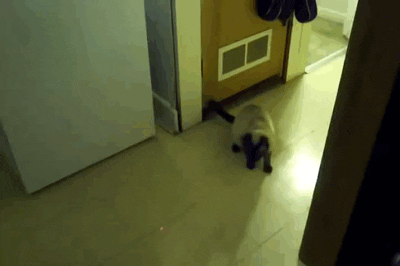
Where is `doorjamb`? This screenshot has height=266, width=400. doorjamb is located at coordinates (317, 178).